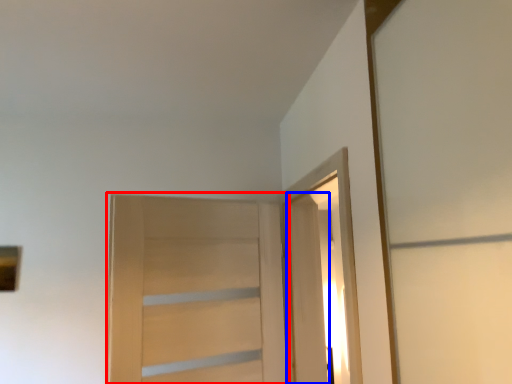
Question: Which of the following is the closest to the observer, door (highlighted by a red box) or door (highlighted by a blue box)?

Choices:
 (A) door
 (B) door

Answer: (A)